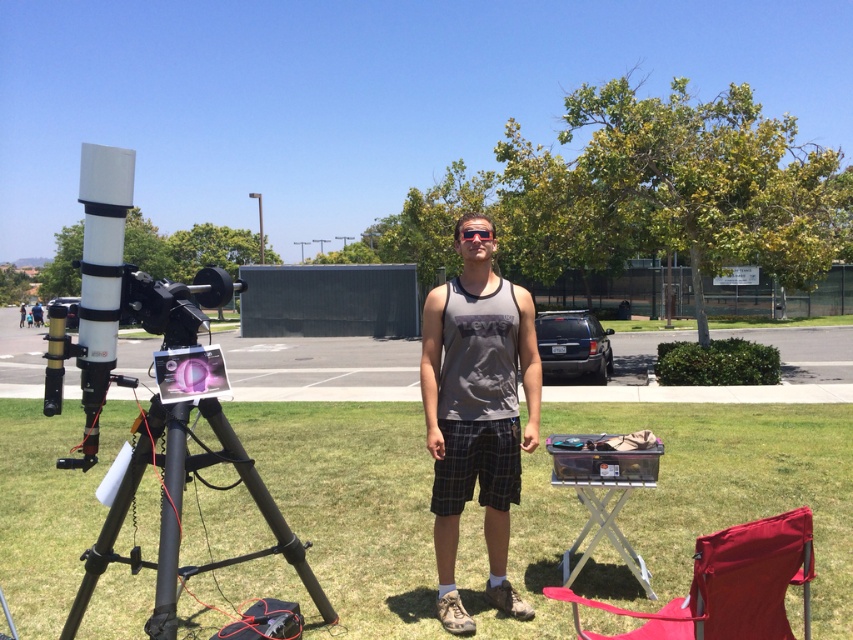
You are standing in the outdoor scene and want to walk to the point that is closer to you. Which point should you walk towards, point [473,244] or point [457,237]?

You should walk towards point [473,244] because it is closer to the viewer than point [457,237].